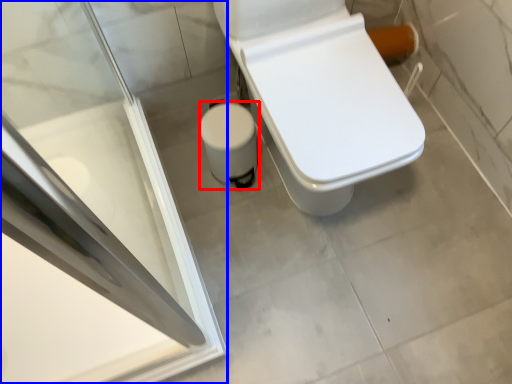
Question: Which of the following is the farthest to the observer, potty (highlighted by a red box) or screen door (highlighted by a blue box)?

Choices:
 (A) potty
 (B) screen door

Answer: (A)